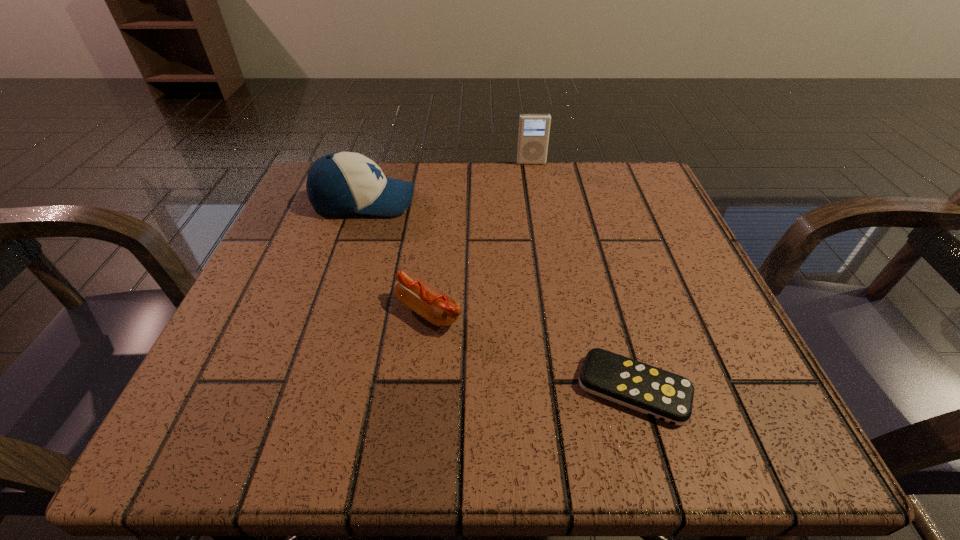
In the image, there is a desktop. Where is `vacant space at the right edge`? vacant space at the right edge is located at coordinates (700, 288).

The height and width of the screenshot is (540, 960). I want to click on free spot at the far right corner of the desktop, so click(609, 210).

You are a GUI agent. You are given a task and a screenshot of the screen. Output one action in this format:
    pyautogui.click(x=<x>, y=<y>)
    Task: Click on the free spot at the near right corner of the desktop
    The height and width of the screenshot is (540, 960).
    Given the screenshot: What is the action you would take?
    (675, 430)

The height and width of the screenshot is (540, 960). I want to click on free area in between the second nearest object and the second farthest object, so click(x=396, y=256).

The image size is (960, 540). I want to click on unoccupied position between the iPod and the shortest object, so click(x=583, y=276).

The width and height of the screenshot is (960, 540). I want to click on vacant area that lies between the baseball cap and the second shortest object, so click(396, 256).

Identify the location of blank region between the third farthest object and the farthest object. This screenshot has height=540, width=960. (480, 237).

Find the location of a particular element. This screenshot has width=960, height=540. vacant region between the remote control and the third farthest object is located at coordinates (531, 350).

Locate an element on the screen. The height and width of the screenshot is (540, 960). free space between the third farthest object and the second farthest object is located at coordinates (396, 256).

Find the location of a particular element. free space between the nearest object and the farthest object is located at coordinates (583, 276).